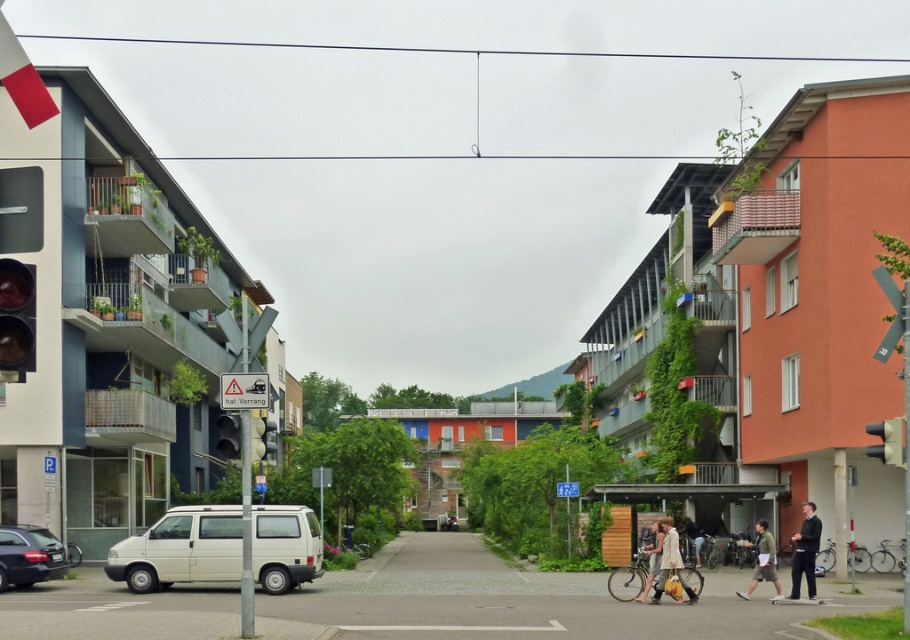
Question: Is light beige fabric bag at lower right bigger than metallic silver traffic light at right?

Choices:
 (A) yes
 (B) no

Answer: (B)

Question: Which object appears closest to the camera in this image?

Choices:
 (A) metallic silver traffic light at right
 (B) light brown leather jacket at lower center
 (C) light beige fabric bag at lower right
 (D) white matte van at center

Answer: (A)

Question: Is dark suit at lower right to the left of matte black traffic light at left from the viewer's perspective?

Choices:
 (A) no
 (B) yes

Answer: (A)

Question: Does dark suit at lower right lie in front of light brown leather jacket at lower center?

Choices:
 (A) yes
 (B) no

Answer: (B)

Question: Which object is positioned closest to the metallic silver traffic light at right?

Choices:
 (A) light beige fabric bag at lower right
 (B) khaki shorts at lower right

Answer: (A)

Question: Estimate the real-world distances between objects in this image. Which object is closer to the shiny black sedan at lower left?

Choices:
 (A) matte glass traffic light at left
 (B) matte black traffic light at left

Answer: (B)